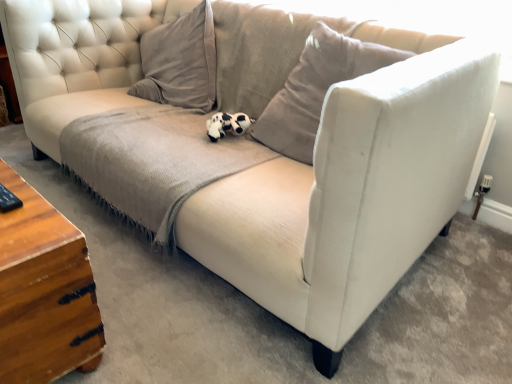
I want to click on black and white plush toy at center, so click(x=227, y=125).

Describe the element at coordinates (227, 125) in the screenshot. I see `black and white plush toy at center` at that location.

Find the location of a particular element. The width and height of the screenshot is (512, 384). black and white plush toy at center is located at coordinates (227, 125).